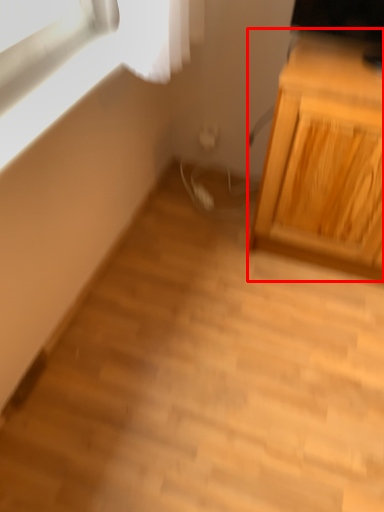
Question: From the image's perspective, what is the correct spatial relationship of cabinetry (annotated by the red box) in relation to window?

Choices:
 (A) below
 (B) above

Answer: (A)